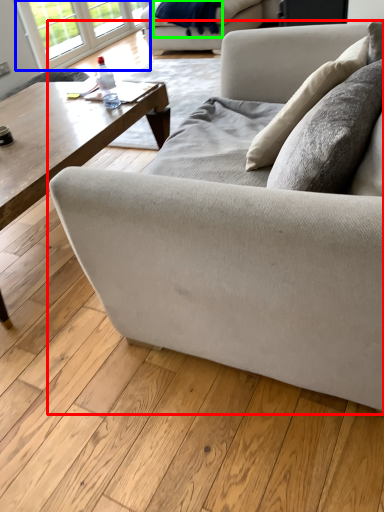
Question: Based on their relative distances, which object is farther from studio couch (highlighted by a red box)? Choose from window (highlighted by a blue box) and blanket (highlighted by a green box).

Choices:
 (A) window
 (B) blanket

Answer: (A)